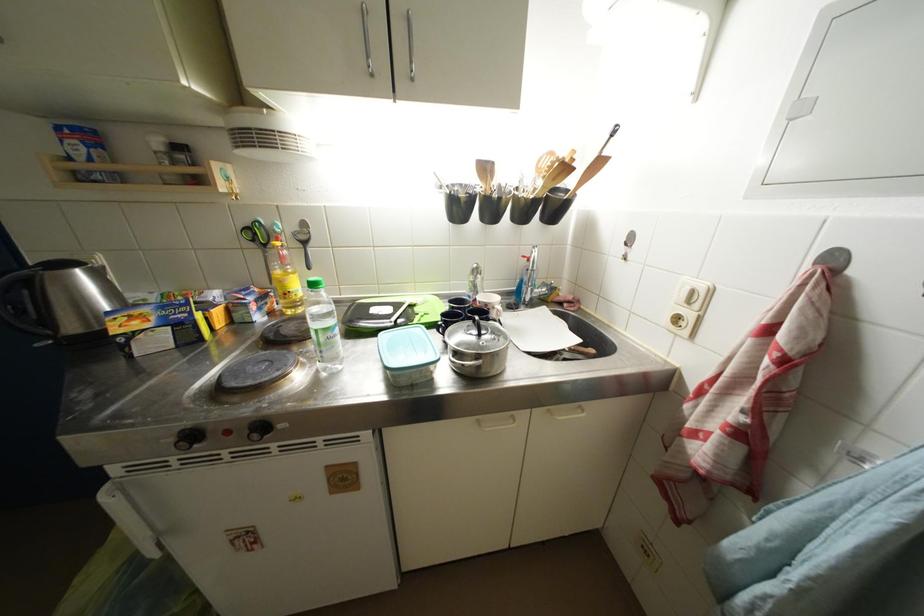
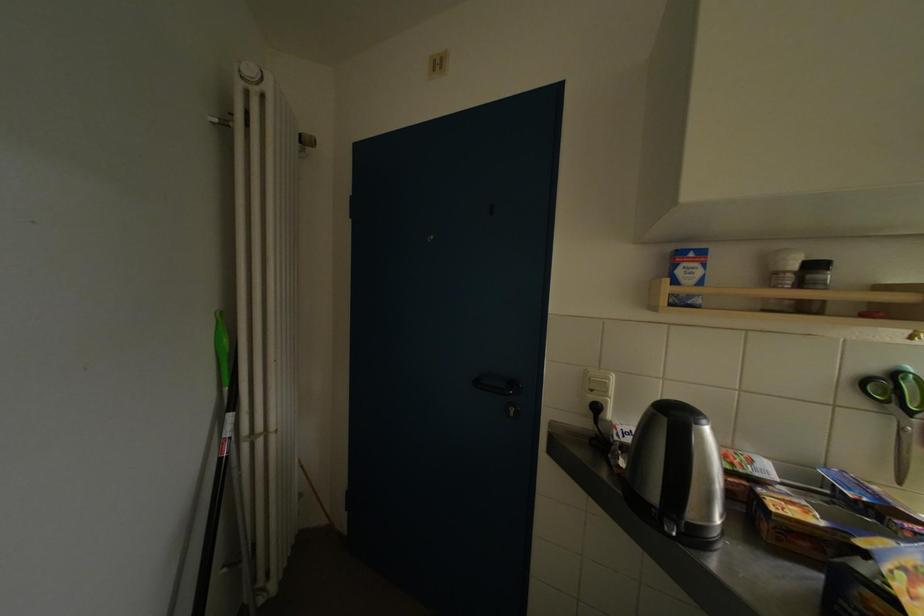
The point at (185, 152) is marked in the first image. Where is the corresponding point in the second image?

(821, 270)